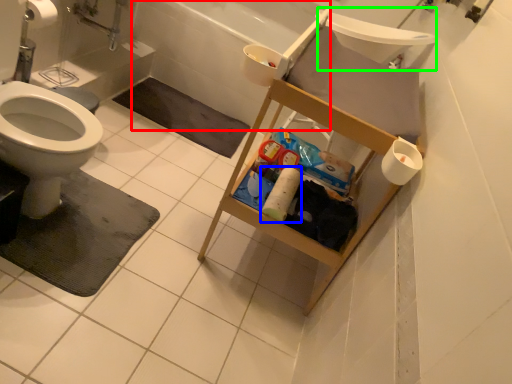
Question: Estimate the real-world distances between objects in this image. Which object is farther from bath (highlighted by a red box), toilet paper (highlighted by a blue box) or sink (highlighted by a green box)?

Choices:
 (A) toilet paper
 (B) sink

Answer: (A)